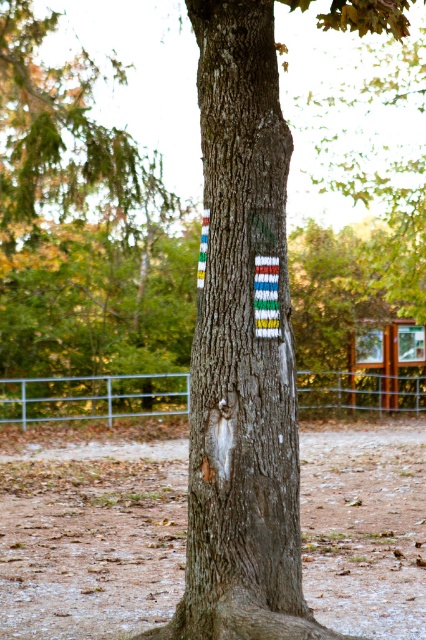
Measure the distance between dirt/dry soil at center and camera.

dirt/dry soil at center and camera are 23.94 feet apart from each other.

Is dirt/dry soil at center to the left of smooth bark tree trunk at center from the viewer's perspective?

Yes, dirt/dry soil at center is to the left of smooth bark tree trunk at center.

This screenshot has height=640, width=426. What are the coordinates of `dirt/dry soil at center` in the screenshot? It's located at (92, 528).

Where is `dirt/dry soil at center`? The width and height of the screenshot is (426, 640). dirt/dry soil at center is located at coordinates (92, 528).

Does smooth bark tree trunk at center have a greater height compared to metallic silver fence at lower center?

Yes, smooth bark tree trunk at center is taller than metallic silver fence at lower center.

Based on the photo, is smooth bark tree trunk at center wider than metallic silver fence at lower center?

Incorrect, smooth bark tree trunk at center's width does not surpass metallic silver fence at lower center's.

Is point (249, 168) positioned after point (167, 372)?

No, (249, 168) is in front of (167, 372).

Find the location of a particular element. The height and width of the screenshot is (640, 426). smooth bark tree trunk at center is located at coordinates (241, 349).

Does dirt/dry soil at center appear under metallic silver fence at lower center?

Indeed, dirt/dry soil at center is positioned under metallic silver fence at lower center.

Is dirt/dry soil at center positioned before metallic silver fence at lower center?

No.

Locate an element on the screen. Image resolution: width=426 pixels, height=640 pixels. dirt/dry soil at center is located at coordinates (92, 528).

The image size is (426, 640). I want to click on dirt/dry soil at center, so click(92, 528).